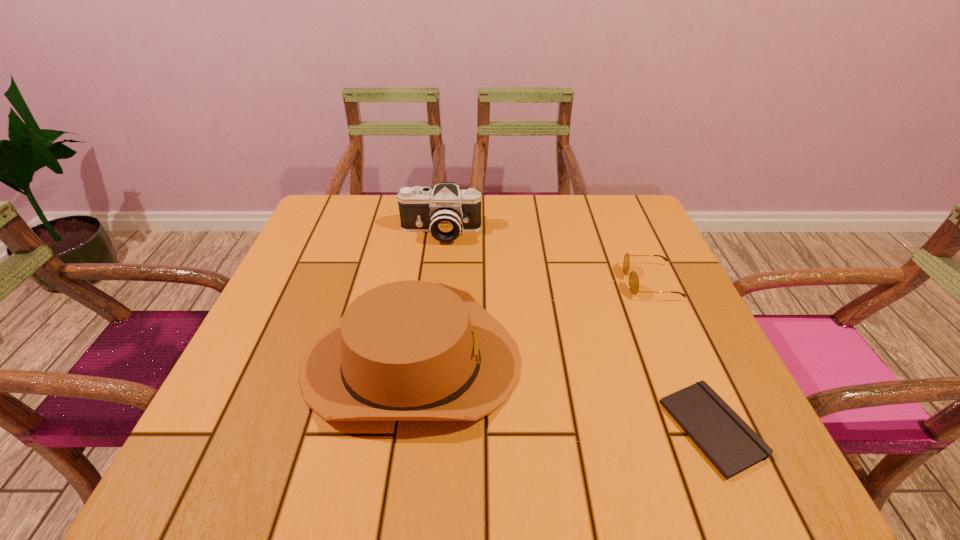
The image size is (960, 540). What are the coordinates of `vacant space located on the left of the shortest object` in the screenshot? It's located at (446, 429).

Find the location of a particular element. object located at the far edge is located at coordinates (446, 212).

Locate an element on the screen. This screenshot has height=540, width=960. cowboy hat that is at the near edge is located at coordinates (411, 350).

Image resolution: width=960 pixels, height=540 pixels. I want to click on checkbook at the near edge, so click(x=732, y=446).

This screenshot has width=960, height=540. In order to click on object that is at the left edge in this screenshot , I will do `click(411, 350)`.

Where is `sunglasses that is at the right edge`? sunglasses that is at the right edge is located at coordinates pos(633,278).

This screenshot has width=960, height=540. I want to click on checkbook that is at the right edge, so click(732, 446).

You are a GUI agent. You are given a task and a screenshot of the screen. Output one action in this format:
    pyautogui.click(x=<x>, y=<y>)
    Task: Click on the object that is at the near left corner
    
    Given the screenshot: What is the action you would take?
    pyautogui.click(x=411, y=350)

Where is `object that is at the near right corner`? This screenshot has width=960, height=540. object that is at the near right corner is located at coordinates (732, 446).

The width and height of the screenshot is (960, 540). I want to click on vacant space at the far edge, so click(527, 221).